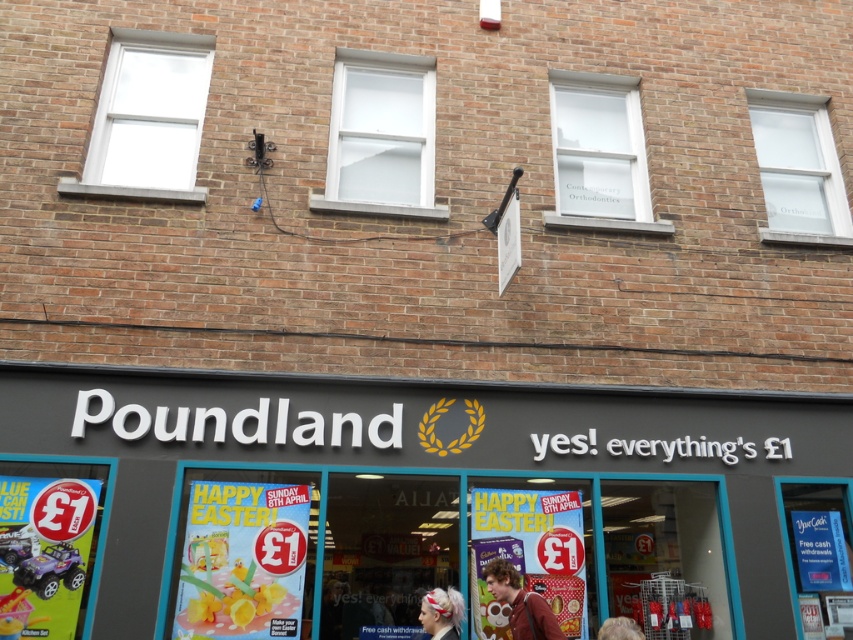
Is transparent glass window at center taller than brown leather jacket at center?

Yes.

Which of these two, transparent glass window at center or brown leather jacket at center, stands shorter?

brown leather jacket at center

Locate an element on the screen. This screenshot has width=853, height=640. transparent glass window at center is located at coordinates [x=598, y=154].

Between transparent glass window at center and transparent glass window at upper right, which one appears on the right side from the viewer's perspective?

Positioned to the right is transparent glass window at upper right.

Describe the element at coordinates (598, 154) in the screenshot. The width and height of the screenshot is (853, 640). I see `transparent glass window at center` at that location.

Identify the location of transparent glass window at center. This screenshot has height=640, width=853. [x=598, y=154].

Can you confirm if transparent glass window at center is bigger than blonde hair at lower center?

Yes, transparent glass window at center is bigger than blonde hair at lower center.

Does point (573, 76) come closer to viewer compared to point (612, 637)?

No.

Where is `transparent glass window at center`? transparent glass window at center is located at coordinates coord(598,154).

Locate an element on the screen. This screenshot has width=853, height=640. transparent glass window at center is located at coordinates (598, 154).